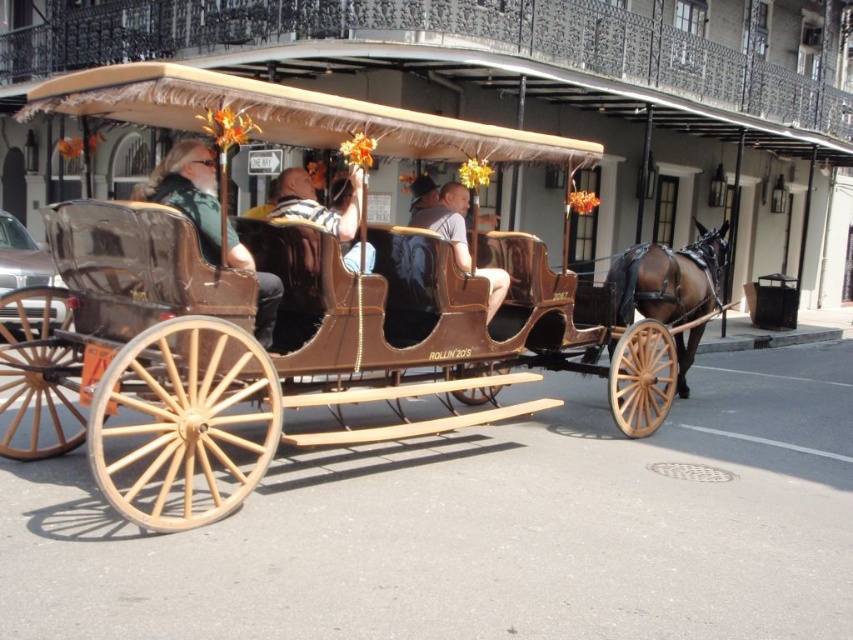
Who is shorter, shiny brown wood horse cart at center or matte brown vest at left?

With less height is shiny brown wood horse cart at center.

At what (x,y) coordinates should I click in order to perform the action: click on shiny brown wood horse cart at center. Please return your answer as a coordinate pair (x, y). The image size is (853, 640). Looking at the image, I should click on (306, 305).

Where is `shiny brown wood horse cart at center`? The width and height of the screenshot is (853, 640). shiny brown wood horse cart at center is located at coordinates (306, 305).

Describe the element at coordinates (189, 192) in the screenshot. I see `matte brown vest at left` at that location.

Consider the image. Is matte brown vest at left in front of metallic silver car at left?

Yes.

Measure the distance between point (276,310) and camera.

Point (276,310) is 5.87 meters from camera.

Find the location of a particular element. The width and height of the screenshot is (853, 640). matte brown vest at left is located at coordinates (189, 192).

Which is more to the right, brown leather horse at right or matte brown vest at left?

brown leather horse at right is more to the right.

Between brown leather horse at right and matte brown vest at left, which one has more height?

matte brown vest at left is taller.

The image size is (853, 640). What are the coordinates of `brown leather horse at right` in the screenshot? It's located at (669, 278).